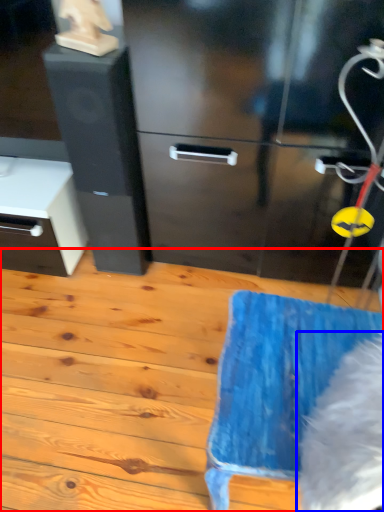
Question: Which point is closer to the camera, wood (highlighted by a red box) or animal (highlighted by a blue box)?

Choices:
 (A) wood
 (B) animal

Answer: (B)